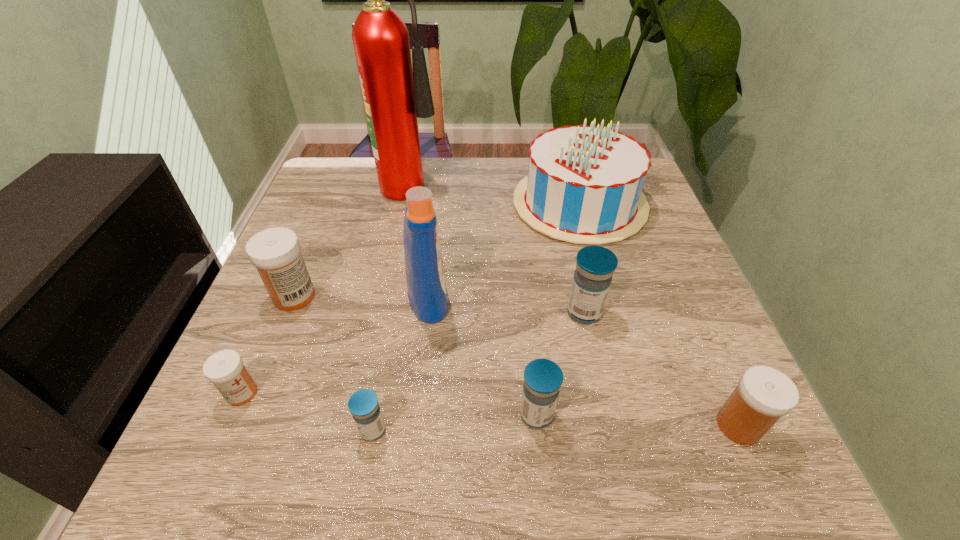
The image size is (960, 540). I want to click on vacant space that's between the smallest white medicine and the second smallest white medicine, so click(491, 409).

Where is `free spot between the red fire extinguisher and the farthest white medicine`? free spot between the red fire extinguisher and the farthest white medicine is located at coordinates (353, 239).

This screenshot has height=540, width=960. Find the location of `free space between the rightmost white medicine and the smallest white medicine`. free space between the rightmost white medicine and the smallest white medicine is located at coordinates (491, 409).

In order to click on free spot between the birthday cake and the second blue medicine from left to right in this screenshot , I will do `click(558, 309)`.

The image size is (960, 540). I want to click on free area in between the second biggest blue medicine and the smallest white medicine, so click(389, 404).

The height and width of the screenshot is (540, 960). Identify the location of vacant region between the rightmost white medicine and the biggest blue medicine. (661, 369).

Locate which object ranks seventh in proximity to the farthest blue medicine. Please provide its 2D coordinates. Your answer should be formatted as a tuple, i.e. [(x, y)], where the tuple contains the x and y coordinates of a point satisfying the conditions above.

[(275, 252)]

Identify which object is located as the fourth nearest to the smallest white medicine. Please provide its 2D coordinates. Your answer should be formatted as a tuple, i.e. [(x, y)], where the tuple contains the x and y coordinates of a point satisfying the conditions above.

[(543, 378)]

Locate which medicine is the fourth closest to the fifth medicine from left to right. Please provide its 2D coordinates. Your answer should be formatted as a tuple, i.e. [(x, y)], where the tuple contains the x and y coordinates of a point satisfying the conditions above.

[(275, 252)]

The width and height of the screenshot is (960, 540). In order to click on medicine that is the closest one to the smallest white medicine in this screenshot , I will do `click(275, 252)`.